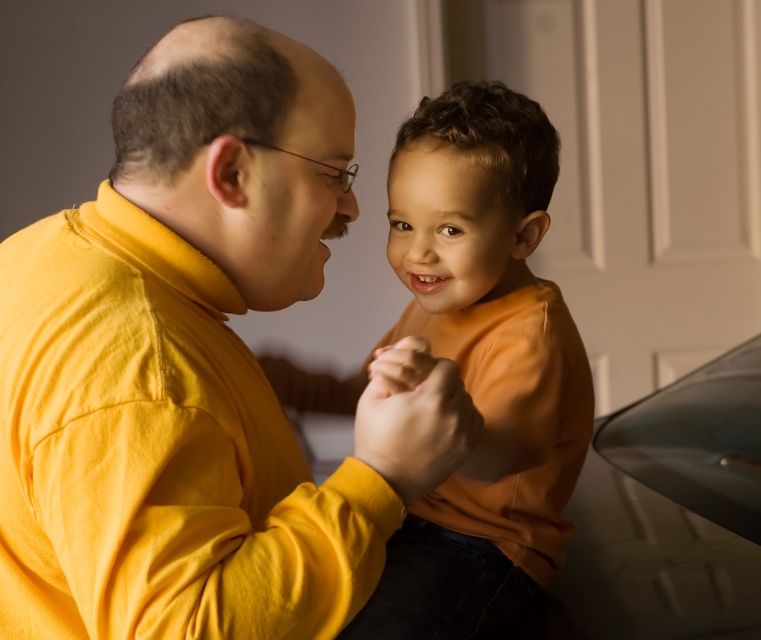
Question: Which point is farther to the camera?

Choices:
 (A) orange matte shirt at center
 (B) yellow matte shirt at center

Answer: (A)

Question: Among these points, which one is nearest to the camera?

Choices:
 (A) (104, 209)
 (B) (549, 378)

Answer: (A)

Question: Can you confirm if yellow matte shirt at center is thinner than orange matte shirt at center?

Choices:
 (A) no
 (B) yes

Answer: (A)

Question: Is yellow matte shirt at center in front of orange matte shirt at center?

Choices:
 (A) no
 (B) yes

Answer: (B)

Question: Is yellow matte shirt at center positioned in front of orange matte shirt at center?

Choices:
 (A) yes
 (B) no

Answer: (A)